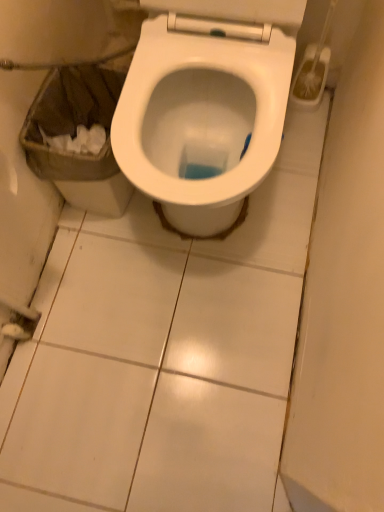
Question: Should I look upward or downward to see white glossy toilet at center?

Choices:
 (A) up
 (B) down

Answer: (A)